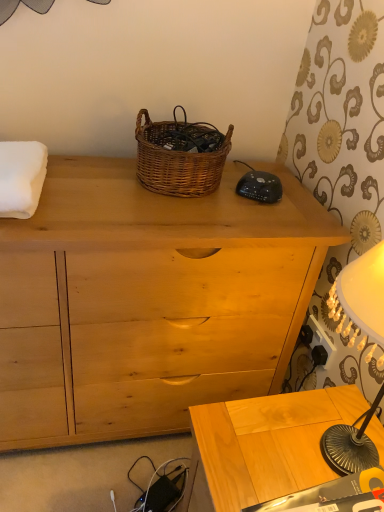
Question: Is the position of light wood table at lower right less distant than that of woven brown picnic basket at center?

Choices:
 (A) no
 (B) yes

Answer: (B)

Question: Is light wood table at lower right wider than woven brown picnic basket at center?

Choices:
 (A) yes
 (B) no

Answer: (A)

Question: Is light wood table at lower right at the right side of woven brown picnic basket at center?

Choices:
 (A) yes
 (B) no

Answer: (A)

Question: Is light wood table at lower right next to woven brown picnic basket at center?

Choices:
 (A) yes
 (B) no

Answer: (B)

Question: Does light wood table at lower right have a lesser height compared to woven brown picnic basket at center?

Choices:
 (A) no
 (B) yes

Answer: (A)

Question: From the image's perspective, is black plastic power outlet at lower right positioned above or below woven brown picnic basket at center?

Choices:
 (A) below
 (B) above

Answer: (A)

Question: Considering the positions of black plastic power outlet at lower right and woven brown picnic basket at center in the image, is black plastic power outlet at lower right taller or shorter than woven brown picnic basket at center?

Choices:
 (A) tall
 (B) short

Answer: (B)

Question: Visually, is black plastic power outlet at lower right positioned to the left or to the right of woven brown picnic basket at center?

Choices:
 (A) left
 (B) right

Answer: (B)

Question: Is black plastic power outlet at lower right wider or thinner than woven brown picnic basket at center?

Choices:
 (A) wide
 (B) thin

Answer: (B)

Question: Is light wood table at lower right wider or thinner than woven brown picnic basket at center?

Choices:
 (A) thin
 (B) wide

Answer: (B)

Question: Considering the positions of light wood table at lower right and woven brown picnic basket at center in the image, is light wood table at lower right bigger or smaller than woven brown picnic basket at center?

Choices:
 (A) small
 (B) big

Answer: (B)

Question: From the image's perspective, is light wood table at lower right positioned above or below woven brown picnic basket at center?

Choices:
 (A) above
 (B) below

Answer: (B)

Question: Visually, is light wood table at lower right positioned to the left or to the right of woven brown picnic basket at center?

Choices:
 (A) right
 (B) left

Answer: (A)

Question: Is woven brown picnic basket at center inside the boundaries of light wood table at lower right, or outside?

Choices:
 (A) outside
 (B) inside

Answer: (A)

Question: Based on their positions, is woven brown picnic basket at center located to the left or right of light wood table at lower right?

Choices:
 (A) right
 (B) left

Answer: (B)